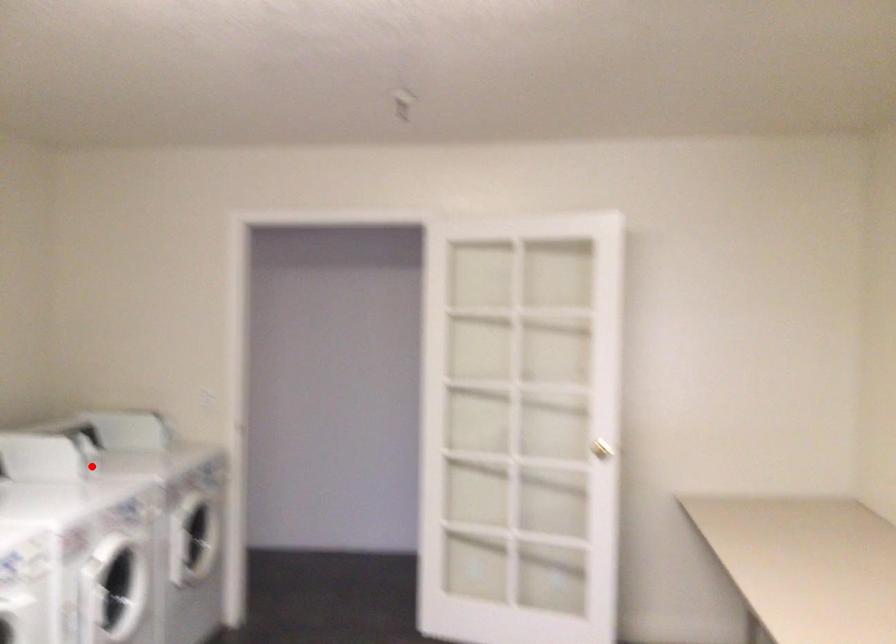
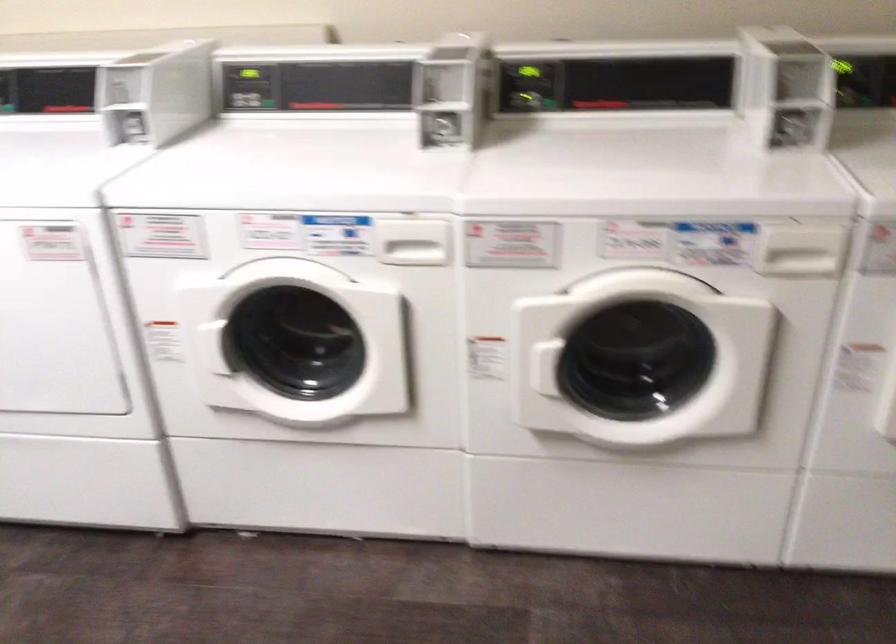
Question: I am providing you with two images of the same scene from different viewpoints. In image1, a red point is highlighted. Considering the same 3D point in image2, which of the following is correct?

Choices:
 (A) It is closer
 (B) It is farther

Answer: (A)